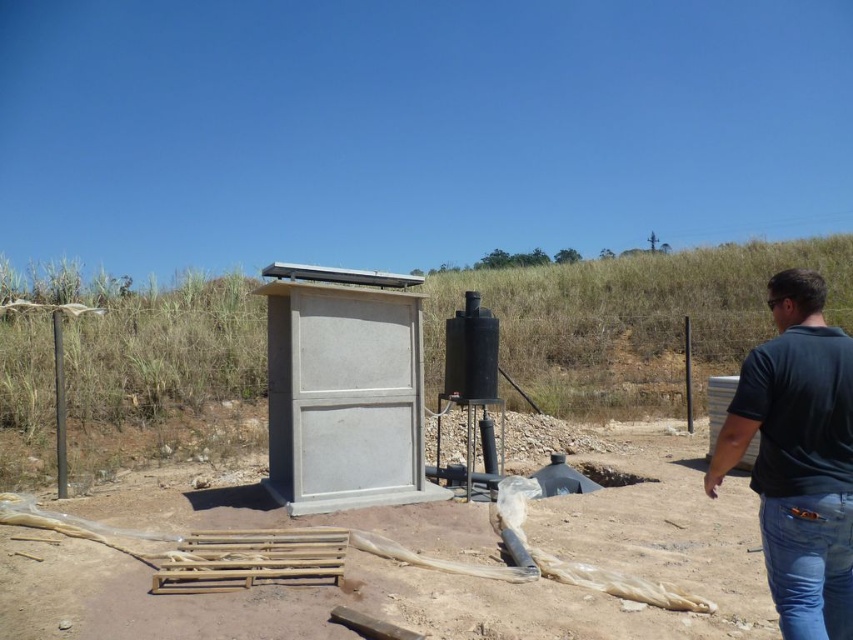
You are a painter who needs to paint the gray concrete cabinet at center and the dark blue shirt at right. Since you can only paint one object at a time, which object should you paint first to avoid having to repaint later?

You should paint the gray concrete cabinet at center first because the dark blue shirt at right is behind it. If you paint the shirt first, you might need to repaint the cabinet afterward if any paint splatters occur.

You are standing next to a camera and want to place a 3 meter long ladder between the gray concrete cabinet at center and the camera. Is there enough space to place the ladder horizontally between them?

The distance between the gray concrete cabinet at center and the camera is 5.54 meters. Since the ladder is 3 meters long, there is sufficient space to place it horizontally between them.